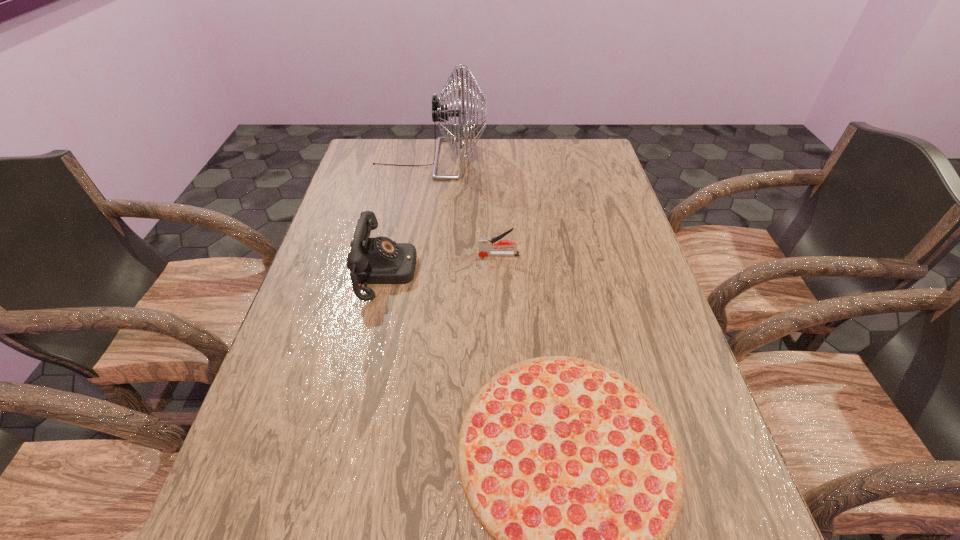
Image resolution: width=960 pixels, height=540 pixels. What are the coordinates of `free area in between the stapler and the farthest object` in the screenshot? It's located at (465, 207).

This screenshot has width=960, height=540. I want to click on free area in between the farthest object and the second tallest object, so click(x=408, y=215).

Where is `unoccupied position between the second shortest object and the fan`? The image size is (960, 540). unoccupied position between the second shortest object and the fan is located at coordinates (465, 207).

Locate an element on the screen. The image size is (960, 540). free space between the telephone and the fan is located at coordinates (408, 215).

This screenshot has height=540, width=960. Identify the location of object that can be found as the third closest to the third shortest object. (440, 113).

Image resolution: width=960 pixels, height=540 pixels. In order to click on object that is the third nearest to the farthest object in this screenshot , I will do `click(571, 469)`.